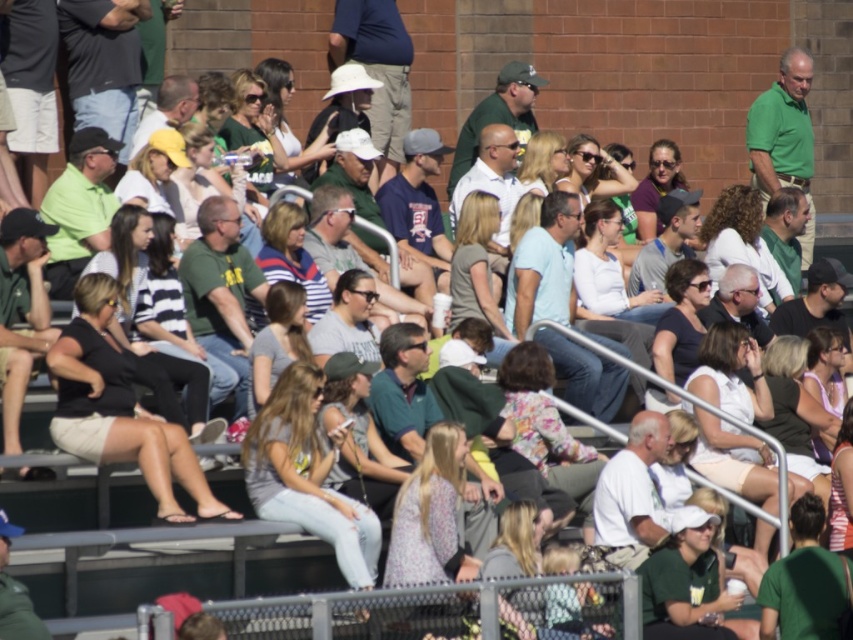
Which of these two, green jersey at center or matte purple shirt at center, stands shorter?

With less height is green jersey at center.

Is point (778, 589) farther from camera compared to point (654, 230)?

No, (778, 589) is closer to viewer.

The height and width of the screenshot is (640, 853). Identify the location of green jersey at center. (804, 580).

Based on the photo, between striped cotton shirt at center and gray fabric shirt at center, which one is positioned higher?

striped cotton shirt at center

Measure the distance between striped cotton shirt at center and camera.

striped cotton shirt at center is 56.75 meters from camera.

The width and height of the screenshot is (853, 640). What are the coordinates of `striped cotton shirt at center` in the screenshot? It's located at (291, 257).

Find the location of `green jersey at center`. green jersey at center is located at coordinates (804, 580).

Who is more distant from viewer, [799,584] or [477,268]?

The point [477,268] is behind.

This screenshot has height=640, width=853. What do you see at coordinates (804, 580) in the screenshot?
I see `green jersey at center` at bounding box center [804, 580].

The height and width of the screenshot is (640, 853). Identify the location of green jersey at center. (804, 580).